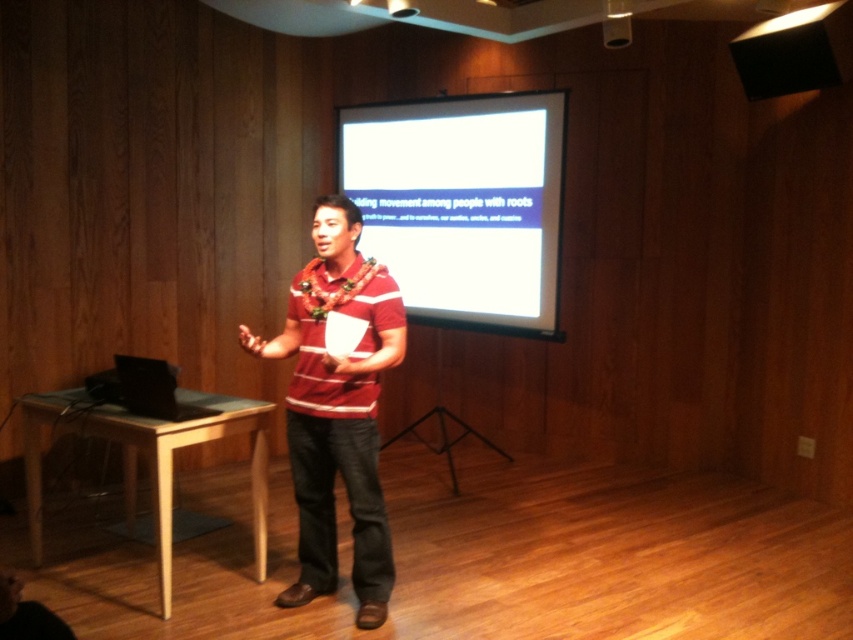
Which of these two, matte red striped shirt at center or matte black speaker at upper right, stands shorter?

matte black speaker at upper right

Between matte red striped shirt at center and matte black speaker at upper right, which one appears on the left side from the viewer's perspective?

From the viewer's perspective, matte red striped shirt at center appears more on the left side.

At what (x,y) coordinates should I click in order to perform the action: click on matte red striped shirt at center. Please return your answer as a coordinate pair (x, y). Looking at the image, I should click on (337, 406).

The image size is (853, 640). I want to click on matte red striped shirt at center, so click(337, 406).

Can you confirm if white glossy projection screen at upper center is taller than matte red striped shirt at center?

Incorrect, white glossy projection screen at upper center's height is not larger of matte red striped shirt at center's.

Which of these two, white glossy projection screen at upper center or matte red striped shirt at center, stands shorter?

Standing shorter between the two is white glossy projection screen at upper center.

Is point (433, 250) positioned before point (366, 484)?

No, it is not.

Where is `white glossy projection screen at upper center`? This screenshot has height=640, width=853. white glossy projection screen at upper center is located at coordinates (463, 204).

Is white glossy projection screen at upper center positioned in front of matte black speaker at upper right?

No, it is behind matte black speaker at upper right.

Is point (375, 154) behind point (773, 33)?

That is True.

Where is `white glossy projection screen at upper center`? white glossy projection screen at upper center is located at coordinates (463, 204).